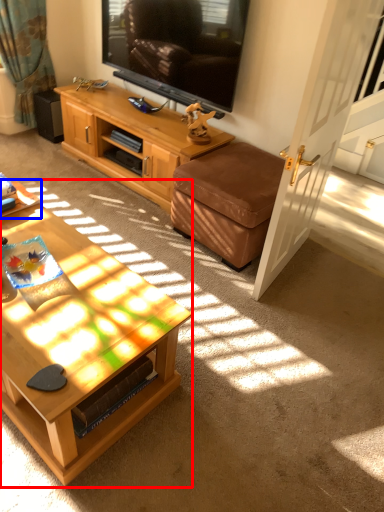
Question: Among these objects, which one is farthest to the camera, coffee table (highlighted by a red box) or desk (highlighted by a blue box)?

Choices:
 (A) coffee table
 (B) desk

Answer: (B)